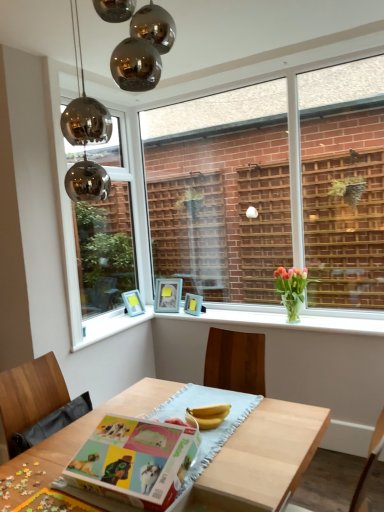
How much space does matte blue picture frame at upper center, positioned as the 2th picture frame in right-to-left order, occupy horizontally?

It is 4.74 inches.

What do you see at coordinates (277, 183) in the screenshot? Image resolution: width=384 pixels, height=512 pixels. I see `clear glass window at center, which ranks as the first window in right-to-left order` at bounding box center [277, 183].

Where is `matte paperboard book at center`? Image resolution: width=384 pixels, height=512 pixels. matte paperboard book at center is located at coordinates [x=136, y=461].

From the image's perspective, is matte blue picture frame at upper center, the 2th picture frame from the left, over matte blue picture frame at center, marked as the third picture frame in a left-to-right arrangement?

Yes, from the image's perspective, matte blue picture frame at upper center, the 2th picture frame from the left, is on top of matte blue picture frame at center, marked as the third picture frame in a left-to-right arrangement.

Looking at this image, could you measure the distance between matte blue picture frame at upper center, positioned as the 2th picture frame in right-to-left order, and matte blue picture frame at center, marked as the third picture frame in a left-to-right arrangement?

matte blue picture frame at upper center, positioned as the 2th picture frame in right-to-left order, is 6.31 inches from matte blue picture frame at center, marked as the third picture frame in a left-to-right arrangement.

Looking at the image, does matte blue picture frame at upper center, the 2th picture frame from the left, seem bigger or smaller compared to matte blue picture frame at center, the first picture frame when ordered from right to left?

matte blue picture frame at upper center, the 2th picture frame from the left, is bigger than matte blue picture frame at center, the first picture frame when ordered from right to left.

From a real-world perspective, which picture frame is the 2nd one above the matte blue picture frame at center, the first picture frame when ordered from right to left? Please provide its 2D coordinates.

[(168, 295)]

Is point (127, 296) in front of point (198, 419)?

No, (127, 296) is further to viewer.

Is matte blue picture frame at upper left, placed as the 3th picture frame when sorted from right to left, wider or thinner than yellow matte bananas at center?

Clearly, matte blue picture frame at upper left, placed as the 3th picture frame when sorted from right to left, has less width compared to yellow matte bananas at center.

Can you tell me how much matte blue picture frame at upper left, placed as the first picture frame when sorted from left to right, and yellow matte bananas at center differ in facing direction?

There is a 137-degree angle between the facing directions of matte blue picture frame at upper left, placed as the first picture frame when sorted from left to right, and yellow matte bananas at center.

From a real-world perspective, is matte blue picture frame at upper left, placed as the 3th picture frame when sorted from right to left, under yellow matte bananas at center?

Actually, matte blue picture frame at upper left, placed as the 3th picture frame when sorted from right to left, is physically above yellow matte bananas at center in the real world.

Considering the positions of objects clear glass window at center, which ranks as the first window in right-to-left order, and matte blue picture frame at upper center, positioned as the 2th picture frame in right-to-left order, in the image provided, who is in front, clear glass window at center, which ranks as the first window in right-to-left order, or matte blue picture frame at upper center, positioned as the 2th picture frame in right-to-left order,?

clear glass window at center, which ranks as the first window in right-to-left order, is in front.

Does clear glass window at center, which is counted as the second window, starting from the left, contain matte blue picture frame at upper center, positioned as the 2th picture frame in right-to-left order?

No, clear glass window at center, which is counted as the second window, starting from the left, does not contain matte blue picture frame at upper center, positioned as the 2th picture frame in right-to-left order.

From the image's perspective, which is below, clear glass window at center, which is counted as the second window, starting from the left, or matte blue picture frame at upper center, positioned as the 2th picture frame in right-to-left order?

From the image's view, matte blue picture frame at upper center, positioned as the 2th picture frame in right-to-left order, is below.

Is clear glass window at center, which is counted as the second window, starting from the left, taller or shorter than matte blue picture frame at upper center, the 2th picture frame from the left?

In the image, clear glass window at center, which is counted as the second window, starting from the left, appears to be taller than matte blue picture frame at upper center, the 2th picture frame from the left.

In terms of size, does matte paperboard book at center appear bigger or smaller than matte blue picture frame at center, the first picture frame when ordered from right to left?

matte paperboard book at center is bigger than matte blue picture frame at center, the first picture frame when ordered from right to left.

Would you say matte blue picture frame at center, the first picture frame when ordered from right to left, is part of matte paperboard book at center's contents?

Actually, matte blue picture frame at center, the first picture frame when ordered from right to left, is outside matte paperboard book at center.

Does matte paperboard book at center touch matte blue picture frame at center, the first picture frame when ordered from right to left?

No, matte paperboard book at center is not making contact with matte blue picture frame at center, the first picture frame when ordered from right to left.

Is matte paperboard book at center at the right side of matte blue picture frame at center, the first picture frame when ordered from right to left?

No, matte paperboard book at center is not to the right of matte blue picture frame at center, the first picture frame when ordered from right to left.

From a real-world perspective, which is physically above, white glossy window sill at center or matte paperboard book at center?

white glossy window sill at center, from a real-world perspective.

In terms of width, does white glossy window sill at center look wider or thinner when compared to matte paperboard book at center?

Clearly, white glossy window sill at center has less width compared to matte paperboard book at center.

Is white glossy window sill at center at the left side of matte paperboard book at center?

No.

Is matte paperboard book at center completely or partially inside white glossy window sill at center?

No.

Considering the relative sizes of matte blue picture frame at upper center, positioned as the 2th picture frame in right-to-left order, and matte blue picture frame at upper left, placed as the 3th picture frame when sorted from right to left, in the image provided, is matte blue picture frame at upper center, positioned as the 2th picture frame in right-to-left order, bigger than matte blue picture frame at upper left, placed as the 3th picture frame when sorted from right to left,?

Indeed, matte blue picture frame at upper center, positioned as the 2th picture frame in right-to-left order, has a larger size compared to matte blue picture frame at upper left, placed as the 3th picture frame when sorted from right to left.

Considering the sizes of objects matte blue picture frame at upper center, the 2th picture frame from the left, and matte blue picture frame at upper left, placed as the 3th picture frame when sorted from right to left, in the image provided, who is taller, matte blue picture frame at upper center, the 2th picture frame from the left, or matte blue picture frame at upper left, placed as the 3th picture frame when sorted from right to left,?

With more height is matte blue picture frame at upper center, the 2th picture frame from the left.

From a real-world perspective, is matte blue picture frame at upper center, positioned as the 2th picture frame in right-to-left order, physically located above or below matte blue picture frame at upper left, placed as the 3th picture frame when sorted from right to left?

matte blue picture frame at upper center, positioned as the 2th picture frame in right-to-left order, is above matte blue picture frame at upper left, placed as the 3th picture frame when sorted from right to left.

Looking at this image, could you tell me if matte blue picture frame at upper center, positioned as the 2th picture frame in right-to-left order, is facing matte blue picture frame at upper left, placed as the first picture frame when sorted from left to right?

No.

Does matte blue picture frame at upper center, positioned as the 2th picture frame in right-to-left order, appear on the right side of white glossy window sill at center?

In fact, matte blue picture frame at upper center, positioned as the 2th picture frame in right-to-left order, is to the left of white glossy window sill at center.

Which object is more forward, matte blue picture frame at upper center, positioned as the 2th picture frame in right-to-left order, or white glossy window sill at center?

white glossy window sill at center is in front.

Who is taller, matte blue picture frame at upper center, positioned as the 2th picture frame in right-to-left order, or white glossy window sill at center?

matte blue picture frame at upper center, positioned as the 2th picture frame in right-to-left order.

Is matte blue picture frame at upper center, the 2th picture frame from the left, far from white glossy window sill at center?

They are positioned close to each other.

This screenshot has width=384, height=512. What are the coordinates of `picture frame that is the 1st one when counting leftward from the matte blue picture frame at center, marked as the third picture frame in a left-to-right arrangement` in the screenshot? It's located at (168, 295).

At what (x,y) coordinates should I click in order to perform the action: click on banana on the right of the matte blue picture frame at upper left, placed as the 3th picture frame when sorted from right to left. Please return your answer as a coordinate pair (x, y). Image resolution: width=384 pixels, height=512 pixels. Looking at the image, I should click on (208, 415).

Considering their positions, is matte blue picture frame at center, marked as the third picture frame in a left-to-right arrangement, positioned further to metallic glass window at upper left, acting as the second window starting from the right, than matte blue picture frame at upper center, the 2th picture frame from the left?

matte blue picture frame at center, marked as the third picture frame in a left-to-right arrangement, lies further to metallic glass window at upper left, acting as the second window starting from the right, than the other object.

Estimate the real-world distances between objects in this image. Which object is closer to matte blue picture frame at upper left, placed as the 3th picture frame when sorted from right to left, yellow matte bananas at center or light wood table at center?

Based on the image, light wood table at center appears to be nearer to matte blue picture frame at upper left, placed as the 3th picture frame when sorted from right to left.

When comparing their distances from yellow matte bananas at center, does light wood table at center or clear glass window at center, which is counted as the second window, starting from the left, seem further?

clear glass window at center, which is counted as the second window, starting from the left, lies further to yellow matte bananas at center than the other object.

Looking at the image, which one is located further to yellow matte bananas at center, metallic glass window at upper left, which ranks as the 1th window in left-to-right order, or matte blue picture frame at upper left, placed as the first picture frame when sorted from left to right?

metallic glass window at upper left, which ranks as the 1th window in left-to-right order, lies further to yellow matte bananas at center than the other object.

When comparing their distances from white glossy window sill at center, does metallic glass window at upper left, acting as the second window starting from the right, or clear glass window at center, which is counted as the second window, starting from the left, seem further?

clear glass window at center, which is counted as the second window, starting from the left.

Based on their spatial positions, is clear glass window at center, which is counted as the second window, starting from the left, or matte blue picture frame at center, the first picture frame when ordered from right to left, closer to yellow matte bananas at center?

matte blue picture frame at center, the first picture frame when ordered from right to left, is positioned closer to the anchor yellow matte bananas at center.

Looking at the image, which one is located closer to metallic glass window at upper left, acting as the second window starting from the right, yellow matte bananas at center or light wood table at center?

light wood table at center is closer to metallic glass window at upper left, acting as the second window starting from the right.

Estimate the real-world distances between objects in this image. Which object is further from metallic glass window at upper left, acting as the second window starting from the right, matte blue picture frame at center, the first picture frame when ordered from right to left, or matte paperboard book at center?

matte paperboard book at center lies further to metallic glass window at upper left, acting as the second window starting from the right, than the other object.

This screenshot has height=512, width=384. I want to click on window sill located between light wood table at center and clear glass window at center, which ranks as the first window in right-to-left order, in the depth direction, so click(286, 317).

Locate an element on the screen. Image resolution: width=384 pixels, height=512 pixels. banana located between light wood table at center and matte blue picture frame at upper left, placed as the first picture frame when sorted from left to right, in the depth direction is located at coordinates (208, 415).

Locate an element on the screen. window sill between light wood table at center and metallic glass window at upper left, which ranks as the 1th window in left-to-right order, along the z-axis is located at coordinates tap(286, 317).

Where is `banana between light wood table at center and white glossy window sill at center along the z-axis`? The image size is (384, 512). banana between light wood table at center and white glossy window sill at center along the z-axis is located at coordinates (208, 415).